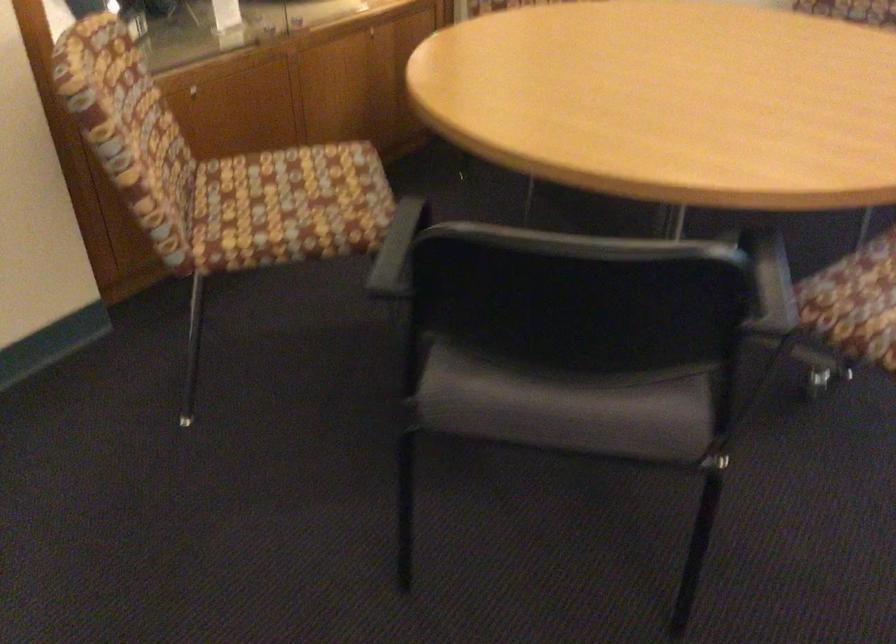
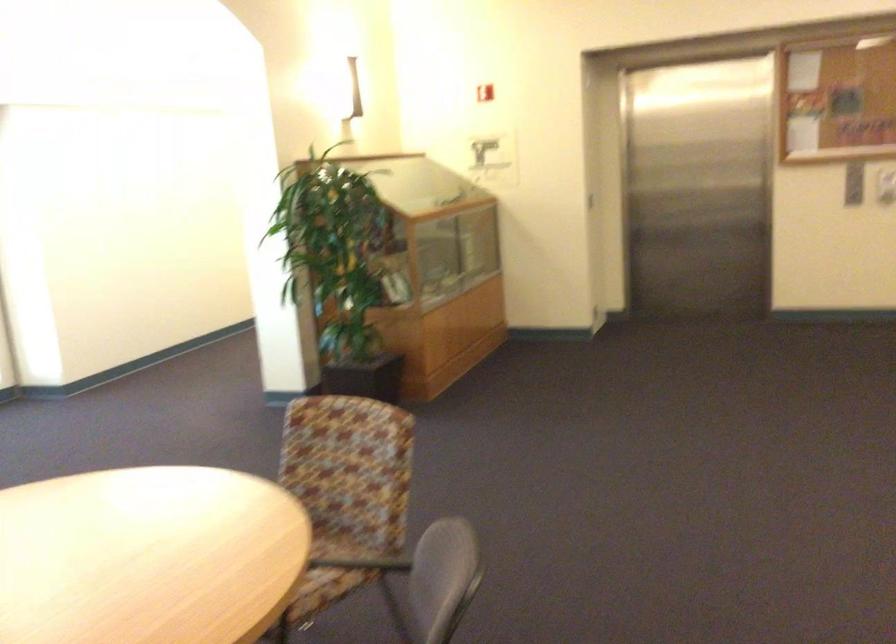
Where in the second image is the point corresponding to [779,174] from the first image?

(288, 535)